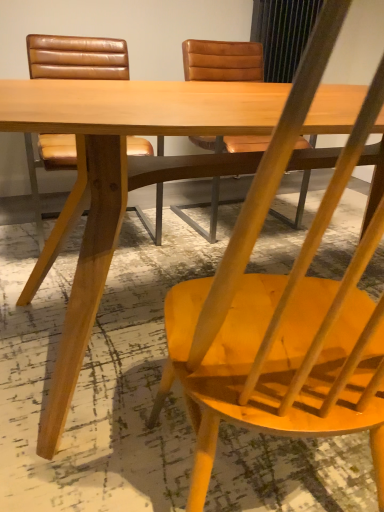
What do you see at coordinates (284, 309) in the screenshot?
I see `matte wood chair at center` at bounding box center [284, 309].

Locate an element on the screen. The image size is (384, 512). matte wood chair at center is located at coordinates (284, 309).

The image size is (384, 512). Find the location of `matte wood chair at center`. matte wood chair at center is located at coordinates (284, 309).